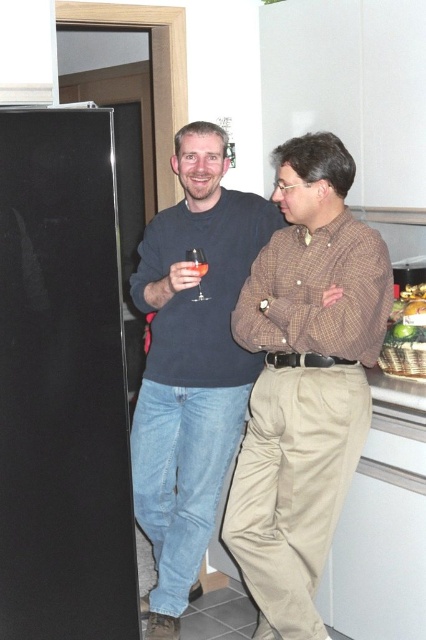
You are standing in the kitchen and need to locate the point at coordinates (304, 381). According to the image, where exactly is this point located?

The point at coordinates (304, 381) is located on the brown checkered shirt at center.

You are a guest at a party and want to grab the transparent glass at left without disturbing the conversation between the two people. Which direction should you approach from relative to the dark blue sweater at center?

You should approach from the right side of the dark blue sweater at center because the transparent glass at left is located to the left of it, meaning the glass is further to the left. By approaching from the right, you can reach the glass without moving past the person in the dark blue sweater at center.